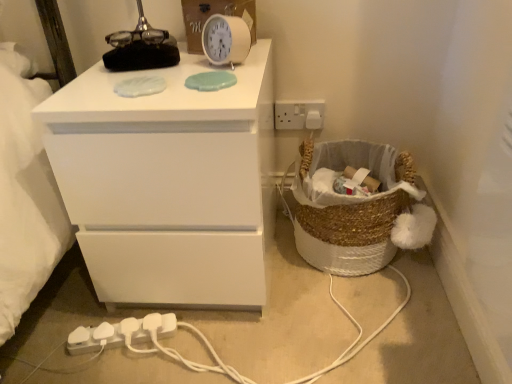
Question: Can you confirm if braided wicker basket at lower right is taller than white matte chest of drawers at upper left?

Choices:
 (A) no
 (B) yes

Answer: (A)

Question: Considering the relative sizes of braided wicker basket at lower right and white matte chest of drawers at upper left in the image provided, is braided wicker basket at lower right shorter than white matte chest of drawers at upper left?

Choices:
 (A) no
 (B) yes

Answer: (B)

Question: Is braided wicker basket at lower right far away from white matte chest of drawers at upper left?

Choices:
 (A) no
 (B) yes

Answer: (A)

Question: From the image's perspective, does braided wicker basket at lower right appear lower than white matte chest of drawers at upper left?

Choices:
 (A) yes
 (B) no

Answer: (A)

Question: Is braided wicker basket at lower right oriented towards white matte chest of drawers at upper left?

Choices:
 (A) no
 (B) yes

Answer: (A)

Question: From a real-world perspective, is white matte chest of drawers at upper left physically located above or below white plastic clock at upper center?

Choices:
 (A) below
 (B) above

Answer: (A)

Question: Considering the positions of white matte chest of drawers at upper left and white plastic clock at upper center in the image, is white matte chest of drawers at upper left wider or thinner than white plastic clock at upper center?

Choices:
 (A) thin
 (B) wide

Answer: (B)

Question: Is white matte chest of drawers at upper left in front of or behind white plastic clock at upper center in the image?

Choices:
 (A) front
 (B) behind

Answer: (A)

Question: Considering the relative positions of white matte chest of drawers at upper left and white plastic clock at upper center in the image provided, is white matte chest of drawers at upper left to the left or to the right of white plastic clock at upper center?

Choices:
 (A) right
 (B) left

Answer: (B)

Question: Considering the positions of white plastic clock at upper center and white matte chest of drawers at upper left in the image, is white plastic clock at upper center taller or shorter than white matte chest of drawers at upper left?

Choices:
 (A) short
 (B) tall

Answer: (A)

Question: Based on their sizes in the image, would you say white plastic clock at upper center is bigger or smaller than white matte chest of drawers at upper left?

Choices:
 (A) big
 (B) small

Answer: (B)

Question: Considering the relative positions of white plastic clock at upper center and white matte chest of drawers at upper left in the image provided, is white plastic clock at upper center to the left or to the right of white matte chest of drawers at upper left?

Choices:
 (A) left
 (B) right

Answer: (B)

Question: Relative to white matte chest of drawers at upper left, is white plastic clock at upper center in front or behind?

Choices:
 (A) front
 (B) behind

Answer: (B)

Question: From a real-world perspective, is white plastic clock at upper center positioned above or below white plastic extension cord at lower left?

Choices:
 (A) below
 (B) above

Answer: (B)

Question: Do you think white plastic clock at upper center is within white plastic extension cord at lower left, or outside of it?

Choices:
 (A) outside
 (B) inside

Answer: (A)